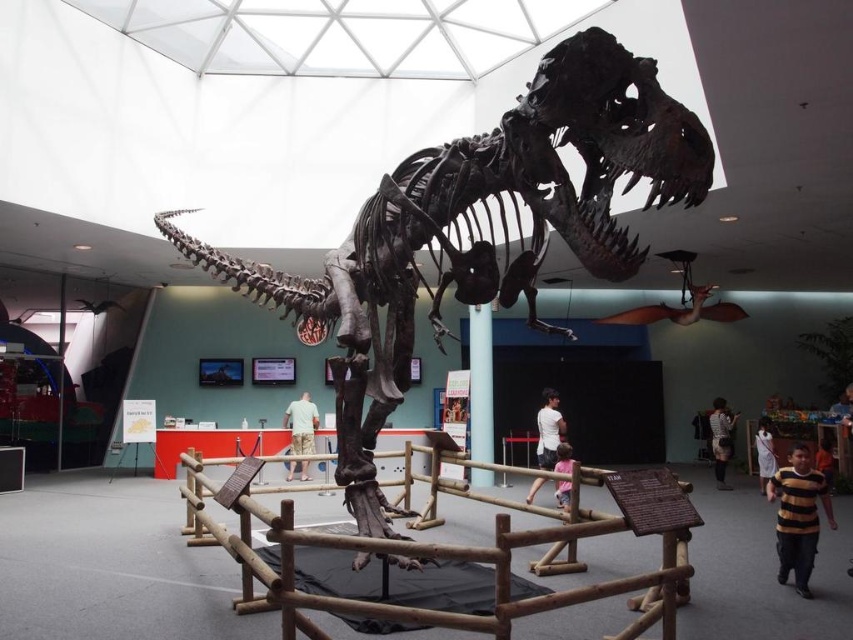
You are a visitor in the museum and you see the blue glossy pillar at center and the striped shirt at lower right. Which object is smaller in size?

The blue glossy pillar at center is smaller in size compared to the striped shirt at lower right according to the description.

You are standing in the museum looking at the Tyrannosaurus rex skeleton. Where is the striped shirt at lower right located in relation to the T. rex skeleton?

The striped shirt at lower right is located at the 2D coordinates point (720, 440) relative to the T. rex skeleton.